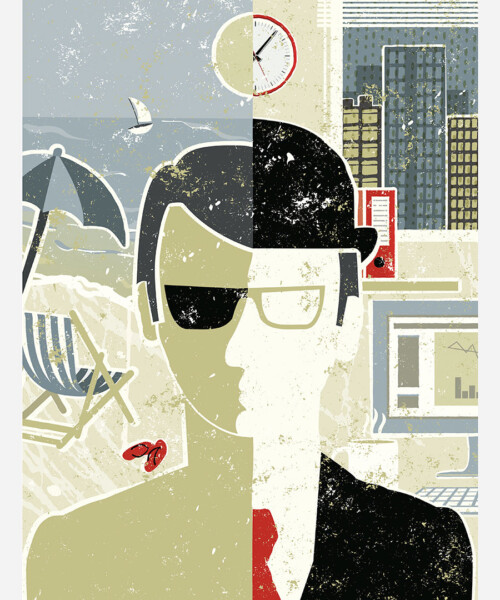
Where is `chair`? This screenshot has height=600, width=500. chair is located at coordinates pos(78,372).